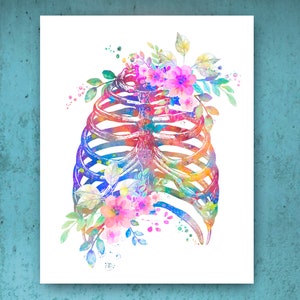
The width and height of the screenshot is (300, 300). In order to click on blue wall right of art in this screenshot , I will do `click(280, 198)`.